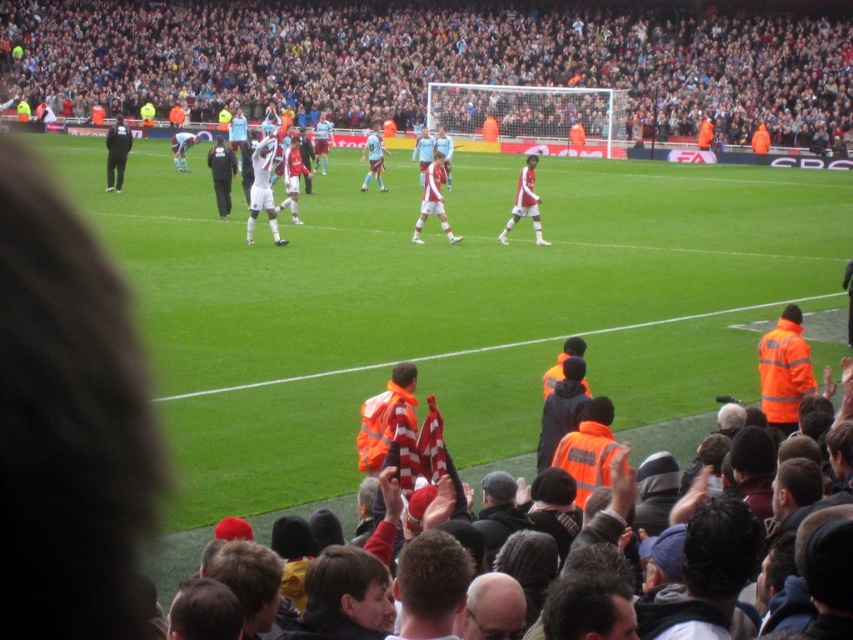
Question: Is green grass field at center bigger than white matte soccer player at center?

Choices:
 (A) yes
 (B) no

Answer: (A)

Question: Which object appears closest to the camera in this image?

Choices:
 (A) black fabric jacket at center
 (B) white matte soccer player at center

Answer: (B)

Question: Where is white matte soccer player at center located in relation to light blue jersey at center in the image?

Choices:
 (A) below
 (B) above

Answer: (A)

Question: Which point appears farthest from the camera in this image?

Choices:
 (A) (556, 65)
 (B) (527, 172)
 (C) (219, 209)

Answer: (A)

Question: Which of the following is the farthest from the observer?

Choices:
 (A) matte white shorts at center
 (B) black fabric jacket at center
 (C) light blue jersey at center

Answer: (C)

Question: Is green grass field at center closer to the viewer compared to white matte soccer player at center?

Choices:
 (A) yes
 (B) no

Answer: (A)